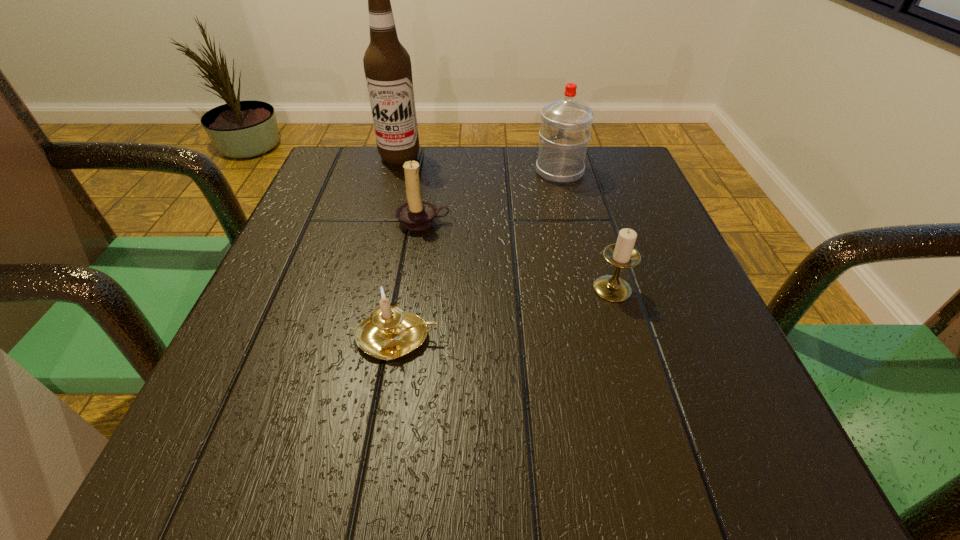
Find the location of a particular element. vacant space situated 0.200m on the handle side of the nearest candle holder is located at coordinates (572, 338).

Locate an element on the screen. The image size is (960, 540). alcohol located in the far edge section of the desktop is located at coordinates (387, 65).

The width and height of the screenshot is (960, 540). In order to click on water bottle that is at the far edge in this screenshot , I will do coord(565,131).

Find the location of a particular element. object that is at the left edge is located at coordinates (387, 65).

Find the location of `water bottle that is at the right edge`. water bottle that is at the right edge is located at coordinates (565, 131).

Image resolution: width=960 pixels, height=540 pixels. In order to click on candle holder present at the right edge in this screenshot , I will do `click(622, 254)`.

Where is `object present at the far left corner`? object present at the far left corner is located at coordinates (387, 65).

Where is `object located at the far right corner`? The height and width of the screenshot is (540, 960). object located at the far right corner is located at coordinates point(565,131).

This screenshot has width=960, height=540. Identify the location of vacant space at the far edge of the desktop. (424, 197).

Where is `vacant space at the near edge of the desktop`? This screenshot has height=540, width=960. vacant space at the near edge of the desktop is located at coordinates [x=516, y=494].